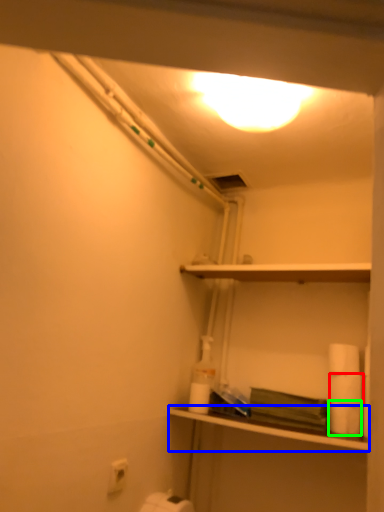
Question: Considering the real-world distances, which object is closest to toilet paper (highlighted by a red box)? shelf (highlighted by a blue box) or toilet paper (highlighted by a green box).

Choices:
 (A) shelf
 (B) toilet paper

Answer: (B)